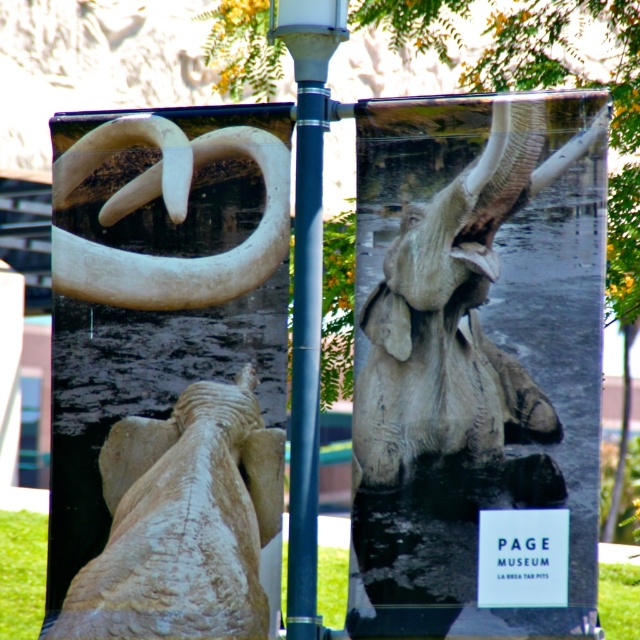
You are a visitor at an art exhibition and see the rough stone elephant at center and the metallic gray pole at center. Which object is taller?

The metallic gray pole at center is taller than the rough stone elephant at center.

You are standing in front of the two banners hanging from the blue pole. You notice two points marked on the banners. Which point, point (x=369, y=561) or point (x=316, y=435), is closer to your eyes?

Point (x=369, y=561) is further to the camera than point (x=316, y=435), so the closer point to your eyes is point (x=316, y=435).

You are an art curator examining two elephant sculptures displayed in a gallery. The first is a matte gray elephant at center, and the second is a rough stone elephant at center. From your vantage point, which elephant sculpture appears closer to you?

The matte gray elephant at center appears closer because it is positioned in front of the rough stone elephant at center.